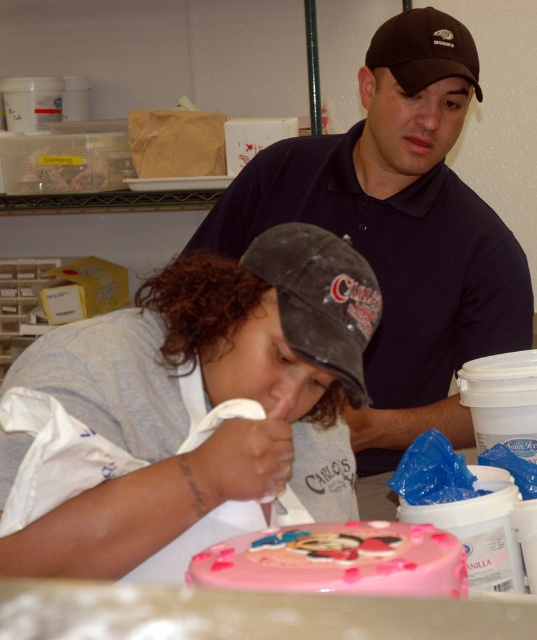
Who is taller, gray fabric apron at lower left or black matte baseball cap at center?

With more height is gray fabric apron at lower left.

Does gray fabric apron at lower left appear under black matte baseball cap at center?

Yes.

Who is more forward, (82,518) or (318,356)?

Point (82,518) is in front.

Locate an element on the screen. The image size is (537, 640). gray fabric apron at lower left is located at coordinates (190, 412).

Image resolution: width=537 pixels, height=640 pixels. In order to click on black matte baseball cap at upper center in this screenshot , I will do `click(398, 236)`.

Image resolution: width=537 pixels, height=640 pixels. Describe the element at coordinates (398, 236) in the screenshot. I see `black matte baseball cap at upper center` at that location.

Identify the location of black matte baseball cap at upper center. The image size is (537, 640). (398, 236).

Who is more forward, (351,557) or (293,266)?

Point (351,557) is more forward.

Between pink glossy cake at center and black matte baseball cap at center, which one has more height?

With more height is black matte baseball cap at center.

Between point (296, 589) and point (345, 353), which one is positioned behind?

The point (345, 353) is more distant.

Locate an element on the screen. pink glossy cake at center is located at coordinates (337, 561).